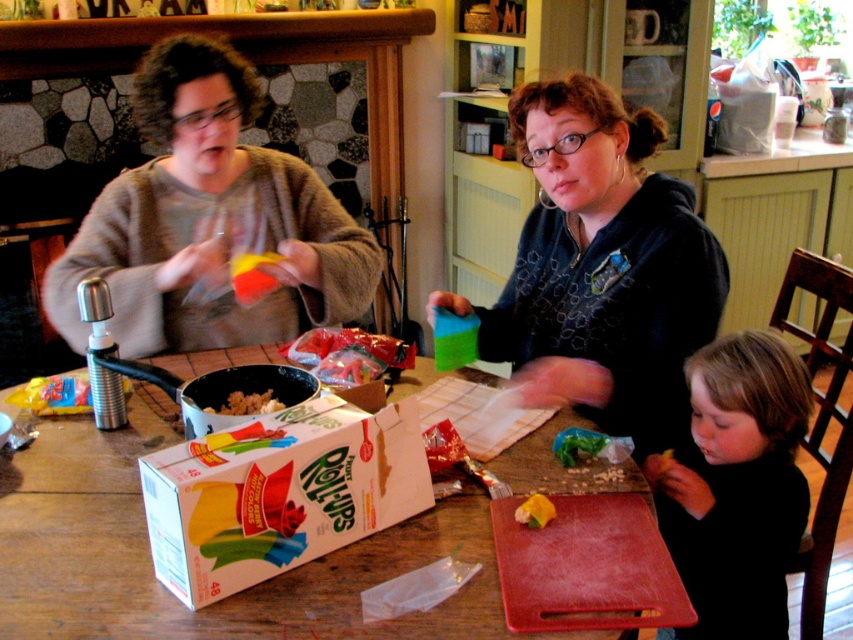
Question: Does matte black hoodie at center appear on the left side of brown crumbly food at center?

Choices:
 (A) no
 (B) yes

Answer: (A)

Question: Is matte gray sweater at left behind white cardboard box at center?

Choices:
 (A) no
 (B) yes

Answer: (B)

Question: Among these points, which one is farthest from the camera?

Choices:
 (A) (541, 516)
 (B) (288, 484)
 (C) (363, 298)
 (D) (235, 392)

Answer: (C)

Question: Based on their relative distances, which object is farther from the black soft shirt at lower right?

Choices:
 (A) yellow plastic toy at lower center
 (B) white cardboard box at center
 (C) brown crumbly food at center

Answer: (C)

Question: Among these points, which one is farthest from the camera?

Choices:
 (A) (532, 502)
 (B) (305, 182)
 (C) (166, 428)

Answer: (B)

Question: Can you confirm if brown crumbly food at center is positioned below yellow plastic toy at lower center?

Choices:
 (A) yes
 (B) no

Answer: (B)